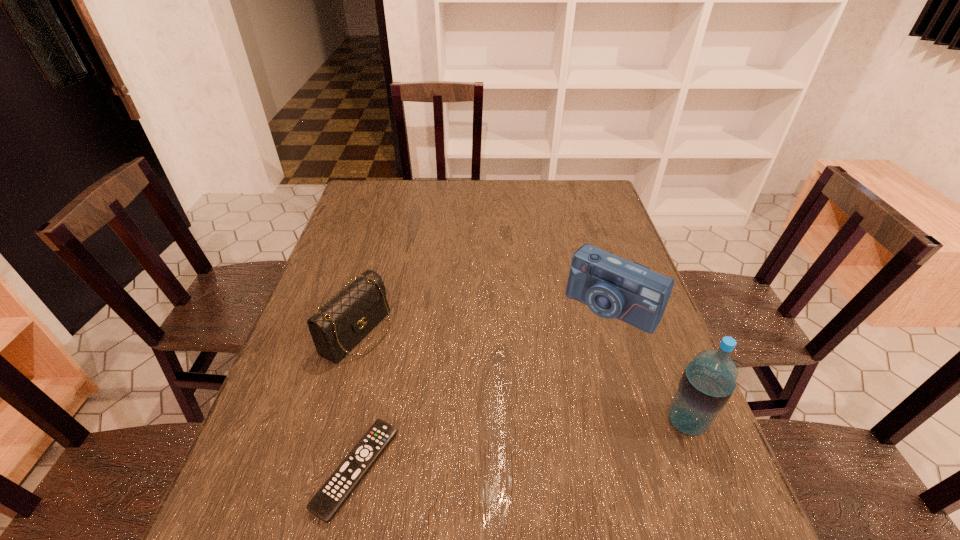
In the image, there is a desktop. Identify the location of vacant space at the right edge. (652, 352).

This screenshot has width=960, height=540. I want to click on free space at the far left corner of the desktop, so pos(387,187).

Where is `free region at the near right corner of the desktop`? free region at the near right corner of the desktop is located at coordinates (713, 461).

This screenshot has width=960, height=540. Identify the location of vacant space in between the tallest object and the camera. (649, 364).

This screenshot has width=960, height=540. In order to click on free spot between the clutch bag and the water bottle in this screenshot , I will do tap(522, 377).

Locate an element on the screen. Image resolution: width=960 pixels, height=540 pixels. free space between the clutch bag and the water bottle is located at coordinates (522, 377).

Find the location of a particular element. unoccupied area between the tallest object and the shortest object is located at coordinates (521, 446).

The image size is (960, 540). Find the location of `unoccupied position between the water bottle and the clutch bag`. unoccupied position between the water bottle and the clutch bag is located at coordinates (522, 377).

Identify the location of vacant space that is in between the camera and the clutch bag. coord(485,320).

Find the location of a particular element. The width and height of the screenshot is (960, 540). empty space that is in between the remote control and the clutch bag is located at coordinates (357, 401).